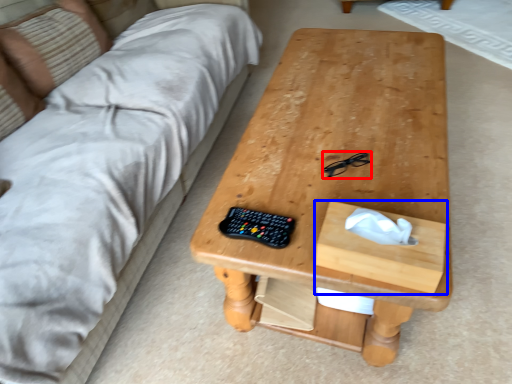
Question: Which object is further to the camera taking this photo, glasses (highlighted by a red box) or drawer (highlighted by a blue box)?

Choices:
 (A) glasses
 (B) drawer

Answer: (A)